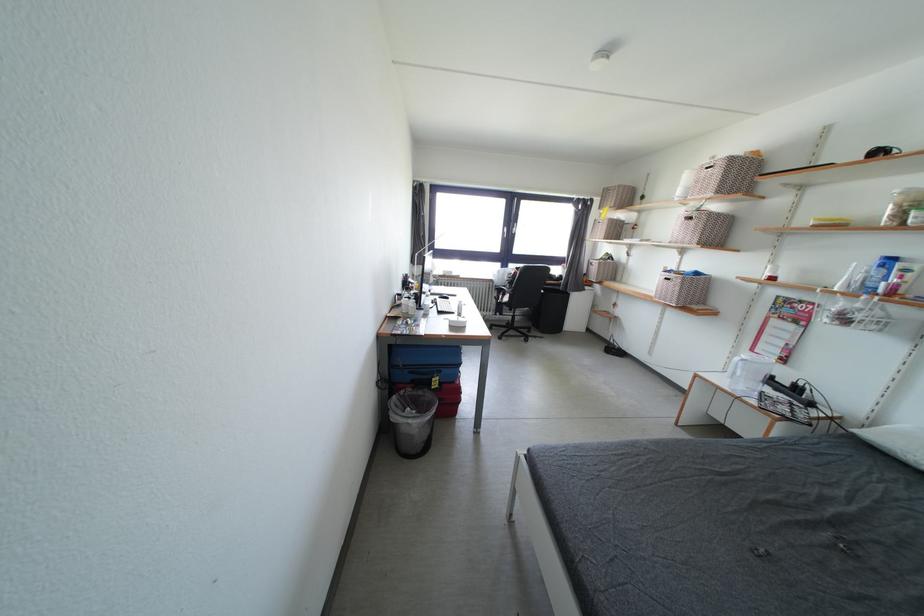
The width and height of the screenshot is (924, 616). Describe the element at coordinates (446, 292) in the screenshot. I see `the black computer mouse` at that location.